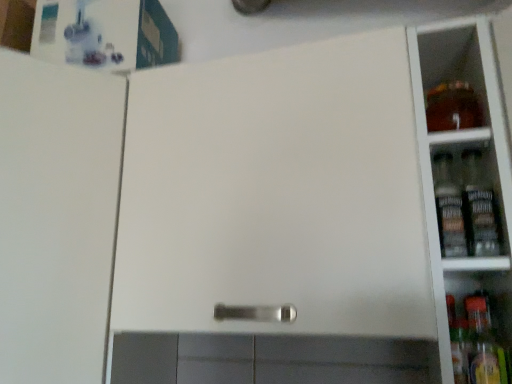
The width and height of the screenshot is (512, 384). I want to click on white matte cabinet door at upper left, so click(x=57, y=218).

Image resolution: width=512 pixels, height=384 pixels. What do you see at coordinates (57, 218) in the screenshot?
I see `white matte cabinet door at upper left` at bounding box center [57, 218].

This screenshot has height=384, width=512. I want to click on white matte cabinet door at upper left, so click(57, 218).